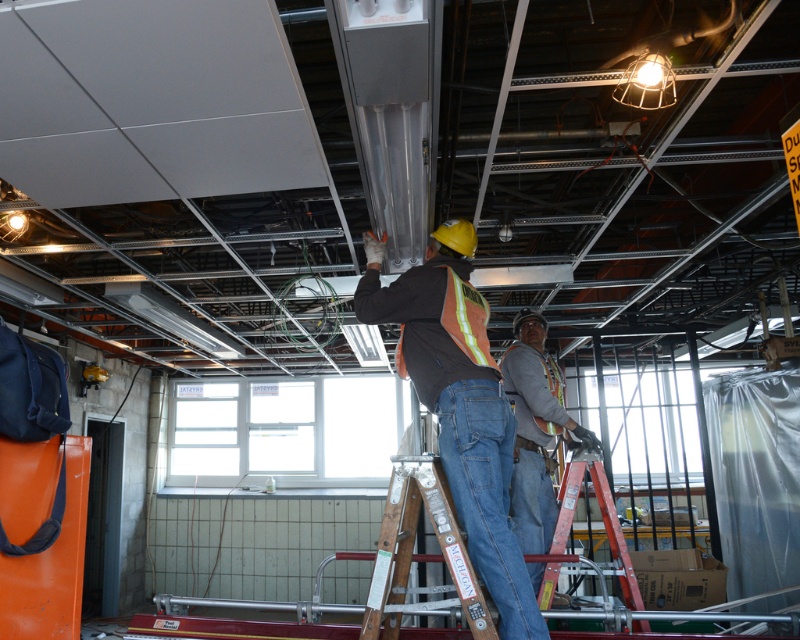
Question: Is orange safety vest at center bigger than metallic red ladder at center?

Choices:
 (A) yes
 (B) no

Answer: (A)

Question: Which object appears farthest from the camera in this image?

Choices:
 (A) reflective orange safety vest at center
 (B) orange safety vest at center

Answer: (B)

Question: Can you confirm if reflective orange safety vest at center is positioned below orange safety vest at center?

Choices:
 (A) no
 (B) yes

Answer: (A)

Question: Is reflective orange safety vest at center bigger than orange safety vest at center?

Choices:
 (A) no
 (B) yes

Answer: (B)

Question: Among these points, which one is nearest to the camera?

Choices:
 (A) (582, 467)
 (B) (478, 513)
 (C) (521, 358)

Answer: (B)

Question: Which point is farther to the camera?

Choices:
 (A) (512, 540)
 (B) (545, 547)
 (C) (602, 490)

Answer: (B)